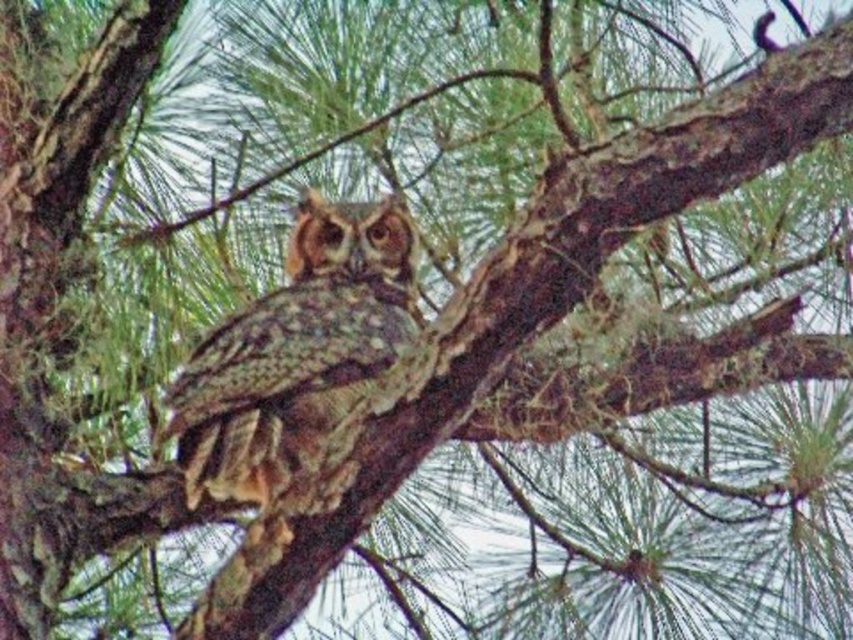
Does camouflage feathers owl at center come in front of brown speckled owl at center?

That is False.

Is camouflage feathers owl at center further to the viewer compared to brown speckled owl at center?

Yes.

Locate an element on the screen. This screenshot has width=853, height=640. camouflage feathers owl at center is located at coordinates (294, 349).

Find the location of a particular element. This screenshot has height=640, width=853. camouflage feathers owl at center is located at coordinates (294, 349).